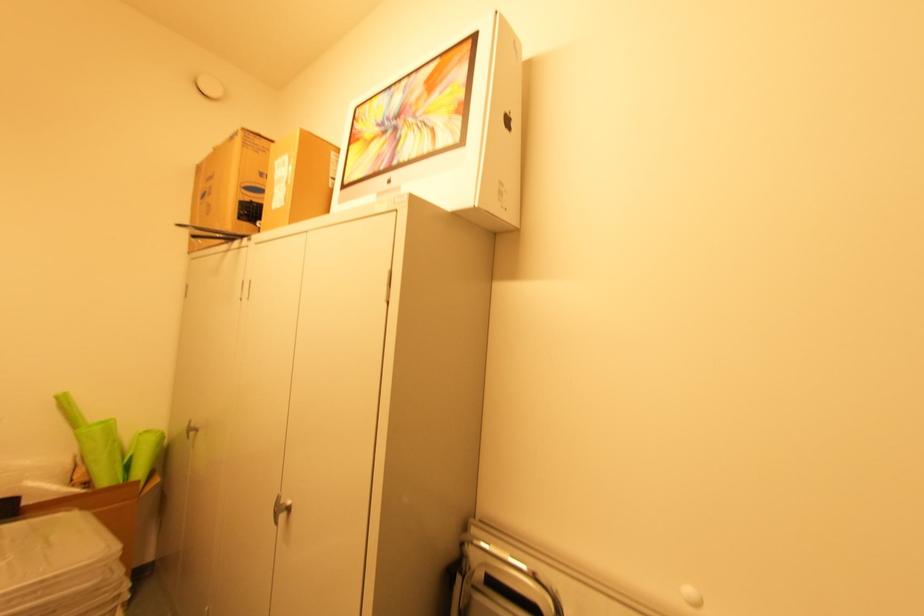
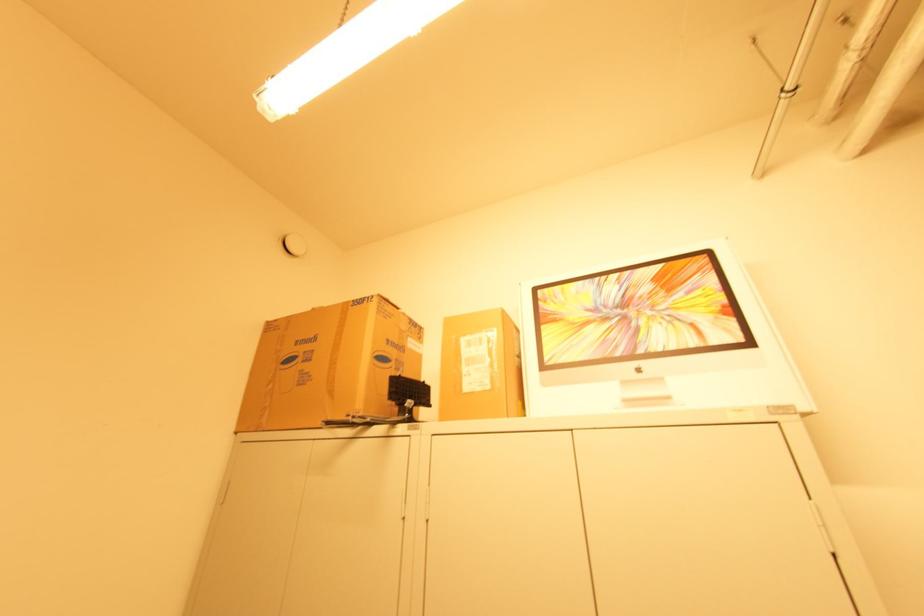
Question: I am providing you with two images of the same scene from different viewpoints. Which of the following objects are not visible in image2?

Choices:
 (A) small cardboard box
 (B) white computer box
 (C) black monitor stand
 (D) none of these

Answer: (D)